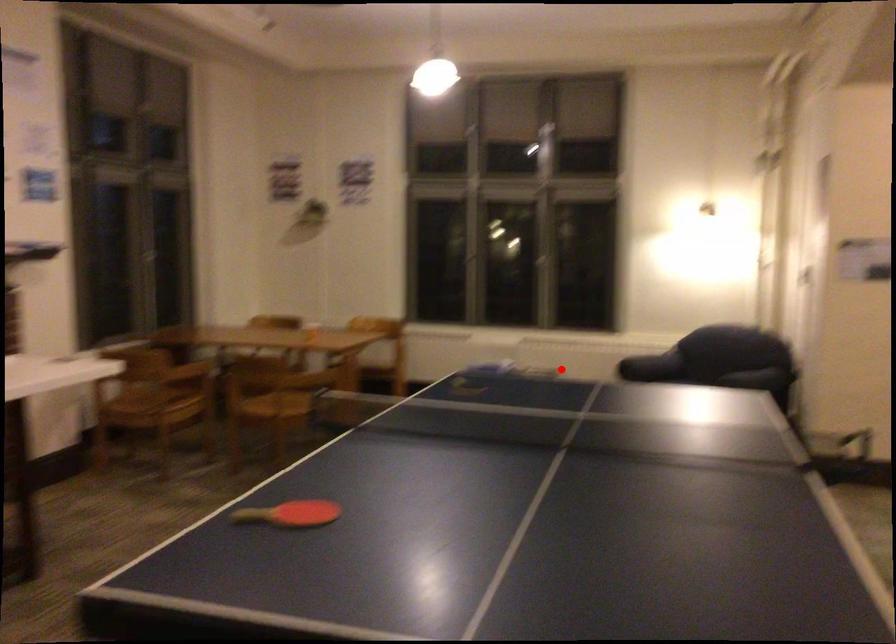
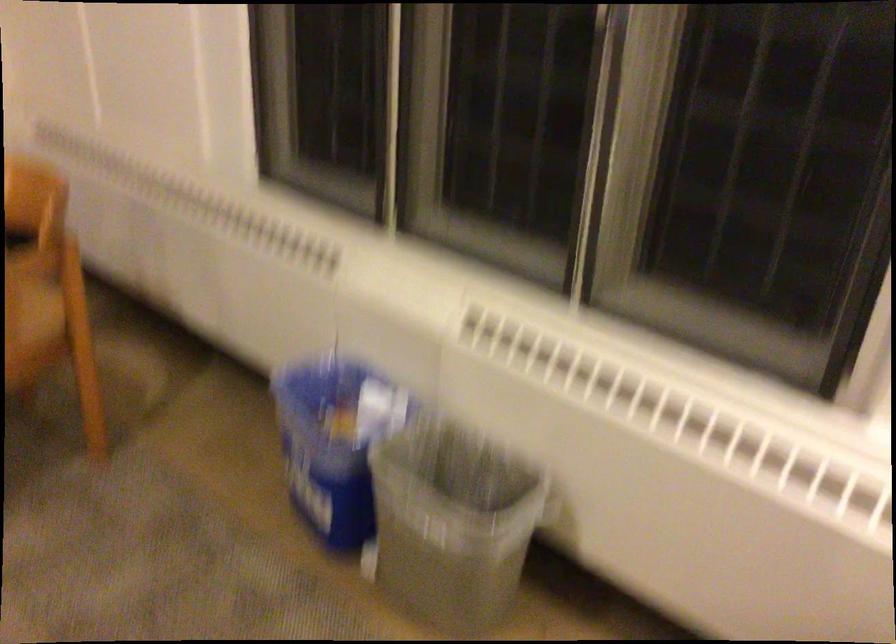
Locate, in the second image, the point that corresponds to the highlighted location in the first image.

(451, 524)